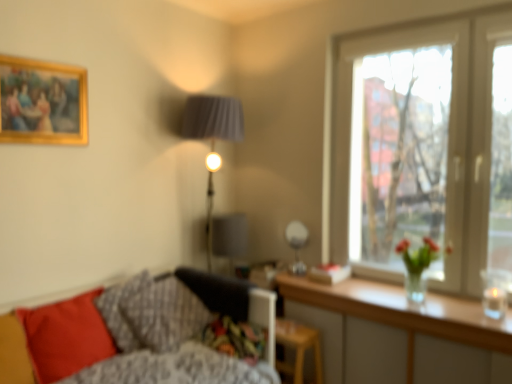
Locate an element on the screen. This screenshot has width=512, height=384. empty space that is ontop of transparent glass window at upper right (from a real-world perspective) is located at coordinates (415, 26).